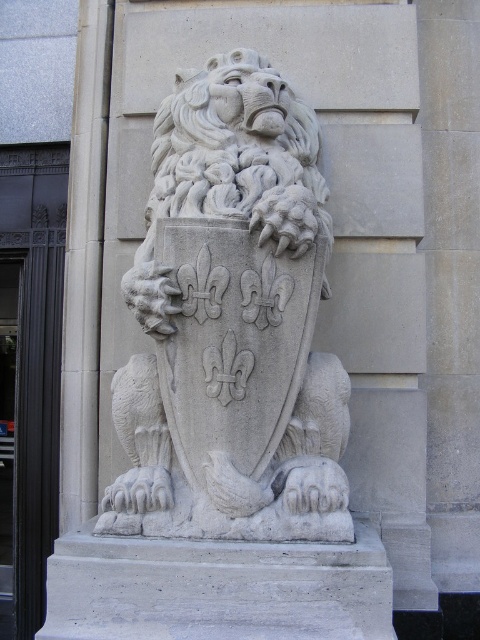
Is point (43, 554) behind point (1, 477)?

No.

Is point (2, 198) closer to camera compared to point (4, 525)?

Yes, it is.

Is point (39, 449) farther from camera compared to point (12, 376)?

No, (39, 449) is in front of (12, 376).

Where is `black metal door at left`? The height and width of the screenshot is (640, 480). black metal door at left is located at coordinates (29, 374).

Does white stone lion at center have a greater height compared to black metal door at left?

No, white stone lion at center is not taller than black metal door at left.

Consider the image. Between white stone lion at center and black metal door at left, which one appears on the left side from the viewer's perspective?

Positioned to the left is black metal door at left.

Is point (262, 451) positioned after point (13, 333)?

No, (262, 451) is closer to viewer.

Identify the location of white stone lion at center. This screenshot has height=640, width=480. click(231, 323).

Does white stone lion at center appear on the left side of black glass door at left?

No, white stone lion at center is not to the left of black glass door at left.

Is point (298, 232) positioned before point (8, 536)?

Yes, point (298, 232) is closer to viewer.

You are a GUI agent. You are given a task and a screenshot of the screen. Output one action in this format:
    pyautogui.click(x=<x>, y=<y>)
    Task: Click on the white stone lion at center
    Image resolution: width=480 pixels, height=640 pixels.
    Given the screenshot: What is the action you would take?
    pyautogui.click(x=231, y=323)